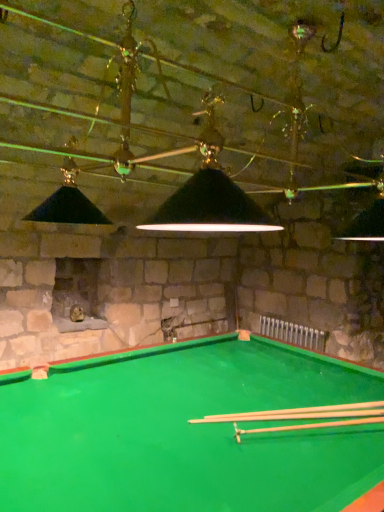
Question: In terms of size, does wooden cue at center, which is the 2th cue in back-to-front order, appear bigger or smaller than smooth wood cue at center, which appears as the 2th cue when viewed from the front?

Choices:
 (A) big
 (B) small

Answer: (A)

Question: From a real-world perspective, relative to smooth wood cue at center, which appears as the 2th cue when viewed from the front, is wooden cue at center, arranged as the 1th cue when viewed from the front, vertically above or below?

Choices:
 (A) below
 (B) above

Answer: (B)

Question: Is wooden cue at center, which is the 2th cue in back-to-front order, in front of or behind smooth wood cue at center, which appears as the 2th cue when viewed from the front, in the image?

Choices:
 (A) behind
 (B) front

Answer: (B)

Question: Is smooth wood cue at center, the 1th cue positioned from the back, taller or shorter than wooden cue at center, which is the 2th cue in back-to-front order?

Choices:
 (A) tall
 (B) short

Answer: (B)

Question: In the image, is smooth wood cue at center, the 1th cue positioned from the back, positioned in front of or behind wooden cue at center, arranged as the 1th cue when viewed from the front?

Choices:
 (A) front
 (B) behind

Answer: (B)

Question: Based on their positions, is smooth wood cue at center, the 1th cue positioned from the back, located to the left or right of wooden cue at center, which is the 2th cue in back-to-front order?

Choices:
 (A) left
 (B) right

Answer: (A)

Question: Is point (344, 404) positioned closer to the camera than point (339, 422)?

Choices:
 (A) closer
 (B) farther

Answer: (B)